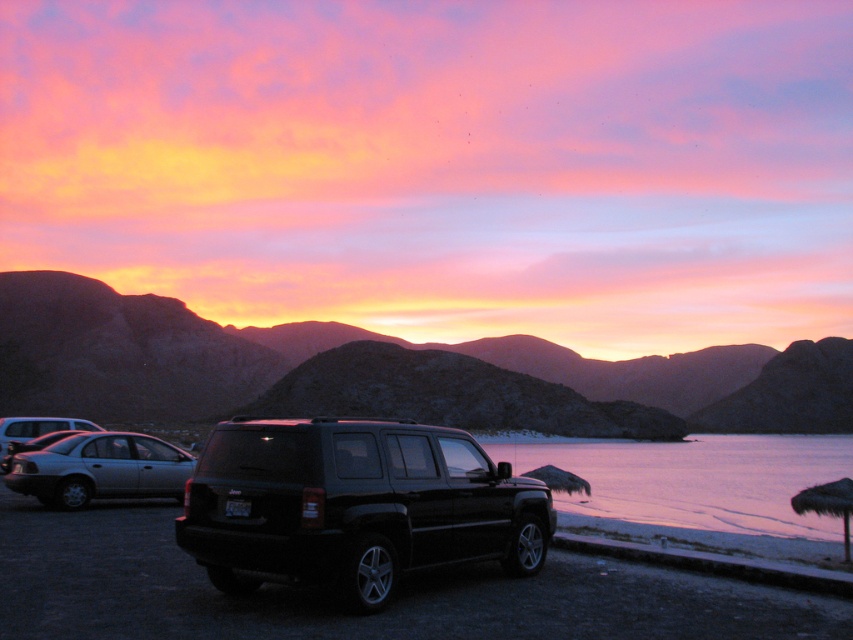
Between pink smooth water at lower right and satin silver sedan at lower left, which one appears on the left side from the viewer's perspective?

satin silver sedan at lower left

Looking at this image, which is below, pink smooth water at lower right or satin silver sedan at lower left?

pink smooth water at lower right

Between point (527, 465) and point (13, 467), which one is positioned behind?

Positioned behind is point (527, 465).

At what (x,y) coordinates should I click in order to perform the action: click on pink smooth water at lower right. Please return your answer as a coordinate pair (x, y). Image resolution: width=853 pixels, height=640 pixels. Looking at the image, I should click on (695, 480).

Is black glossy suv at center positioned before satin silver sedan at lower left?

Yes.

Can you confirm if black glossy suv at center is positioned above satin silver sedan at lower left?

No.

Is point (440, 560) farther from camera compared to point (138, 438)?

No, it is in front of (138, 438).

Locate an element on the screen. black glossy suv at center is located at coordinates (354, 506).

Does silhouetted rock formation at center appear on the left side of pink smooth water at lower right?

Yes, silhouetted rock formation at center is to the left of pink smooth water at lower right.

Can you confirm if silhouetted rock formation at center is positioned below pink smooth water at lower right?

Actually, silhouetted rock formation at center is above pink smooth water at lower right.

Locate an element on the screen. silhouetted rock formation at center is located at coordinates (386, 372).